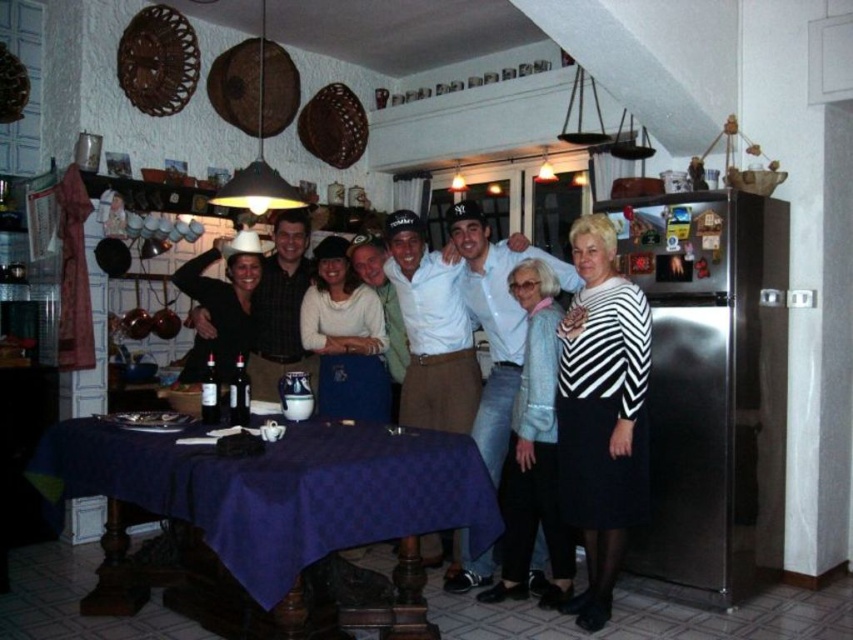
Does matte white shirt at center come behind matte black cowboy hat at left?

No, it is in front of matte black cowboy hat at left.

Between matte white shirt at center and matte black cowboy hat at left, which one is positioned higher?

matte black cowboy hat at left is higher up.

Between point (578, 248) and point (212, 253), which one is positioned behind?

The point (212, 253) is behind.

This screenshot has height=640, width=853. Find the location of `matte white shirt at center`. matte white shirt at center is located at coordinates (560, 397).

Who is positioned more to the right, light blue textured sweater at right or matte black cowboy hat at left?

Positioned to the right is light blue textured sweater at right.

Is point (556, 380) behind point (189, 356)?

No.

This screenshot has width=853, height=640. In order to click on light blue textured sweater at right in this screenshot , I will do `click(535, 444)`.

Does striped fabric sweater at right appear under matte white sweater at center?

Correct, striped fabric sweater at right is located below matte white sweater at center.

Is point (604, 333) more distant than point (332, 257)?

That is False.

The height and width of the screenshot is (640, 853). In order to click on striped fabric sweater at right in this screenshot , I will do `click(601, 412)`.